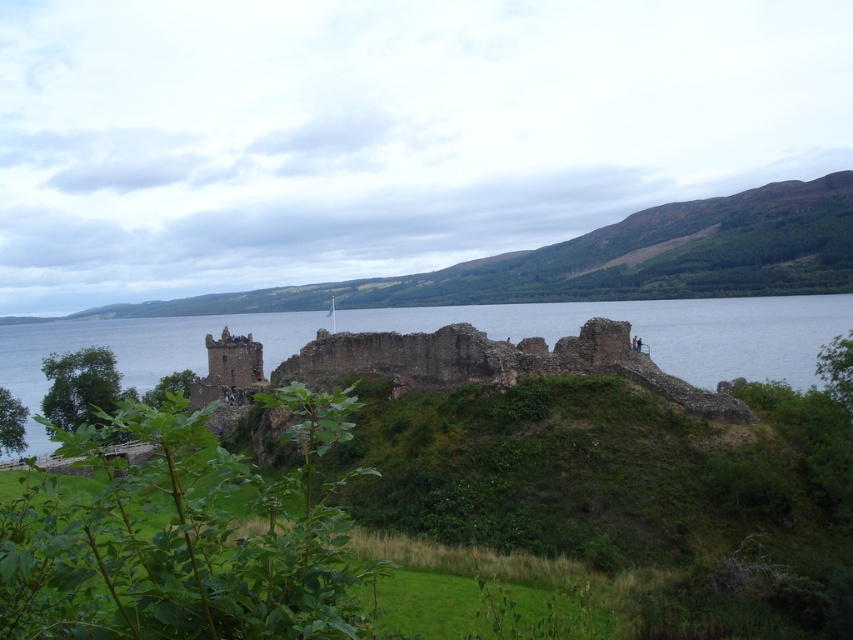
Question: Is green grassy hillside at upper center bigger than brown stone ruins at center?

Choices:
 (A) no
 (B) yes

Answer: (A)

Question: Which object appears farthest from the camera in this image?

Choices:
 (A) green grassy hillside at upper center
 (B) brown stone ruins at center

Answer: (A)

Question: Which point is closer to the camera taking this photo?

Choices:
 (A) (730, 372)
 (B) (758, 208)

Answer: (A)

Question: Can you confirm if green grassy hillside at upper center is positioned to the right of brown stone ruins at center?

Choices:
 (A) yes
 (B) no

Answer: (A)

Question: Does green grassy hillside at upper center appear under brown stone ruins at center?

Choices:
 (A) no
 (B) yes

Answer: (A)